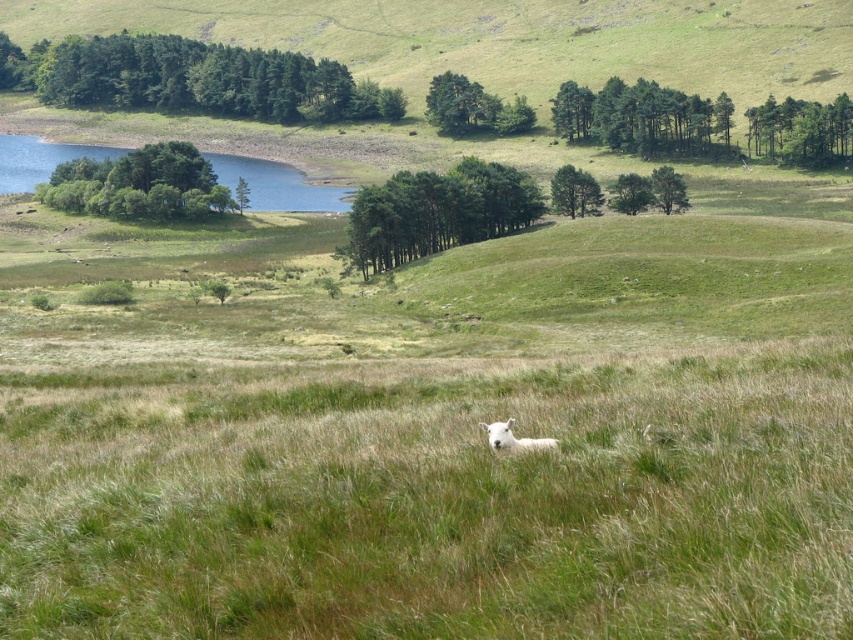
You are a hiker who wants to take a shortcut from the green matte trees at upper right to the green matte tree at center. Given that your average walking pace is 3 miles per hour, how long would it take you to walk this distance?

The distance between the green matte trees at upper right and the green matte tree at center is 237.73 feet. Converting this to miles, it is approximately 0.045 miles. At a walking pace of 3 mph, the time taken would be roughly 0.045 miles divided by 3 mph, which equals 0.015 hours. Converting hours to minutes, this is about 0.9 minutes or approximately 54 seconds.

You are standing at the point with coordinates point (775, 140) and want to walk towards point (566, 212). Which direction should you face to move towards it?

You should face towards the direction away from the viewer since point (775, 140) is further to the viewer than point (566, 212).

You are navigating a drone through the rural landscape shown in the image. Your current position is at point A, which is at coordinates point (77, 74), and you need to reach point B at coordinates point (564, 202). Considering the terrain described in the scene, will you have a clear line of sight between these two points?

Point (77, 74) is behind point (564, 202), so the drone will not have a clear line of sight between them as point A is obscured by the terrain or objects between them.